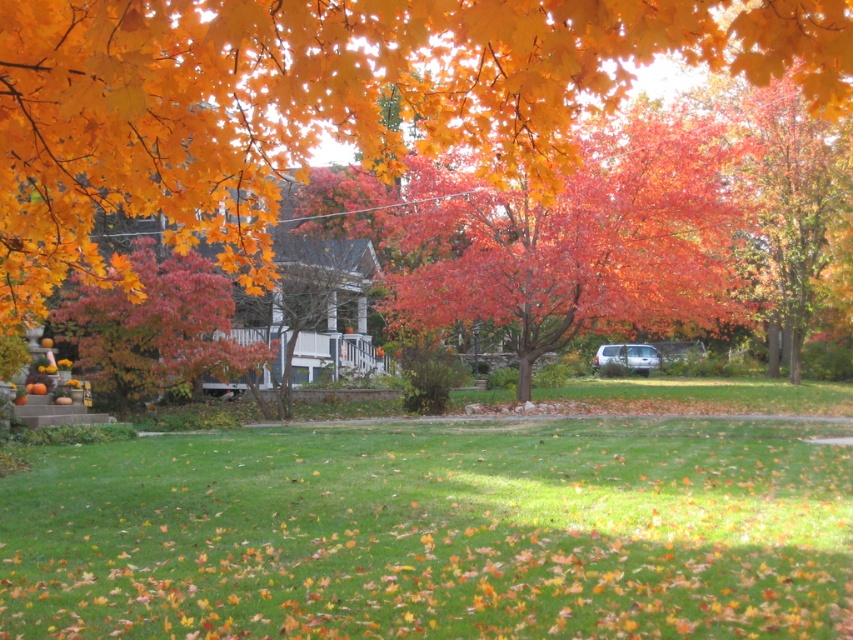
You are designing a garden layout and need to know the spatial relationship between the orange matte leaves at upper center and the smooth orange tree at center. Which one has a greater width?

The orange matte leaves at upper center has a greater width than the smooth orange tree at center.

You are standing in the autumn scene and want to know which area covers more ground between the green grass at lower center and the orange matte leaves at upper center. Can you tell me which one is larger in area?

The orange matte leaves at upper center cover a larger area than the green grass at lower center since the green grass at lower center occupies less space than orange matte leaves at upper center.

Based on the photo, you are a gardener who wants to place a decorative bench between the orange matte leaves at upper center and the vivid red leaves at center. The bench is 2 meters long. Will the space between them accommodate the bench?

The distance between the orange matte leaves at upper center and the vivid red leaves at center is 3.88 meters. Since the bench is 2 meters long, there is sufficient space to place it between them.